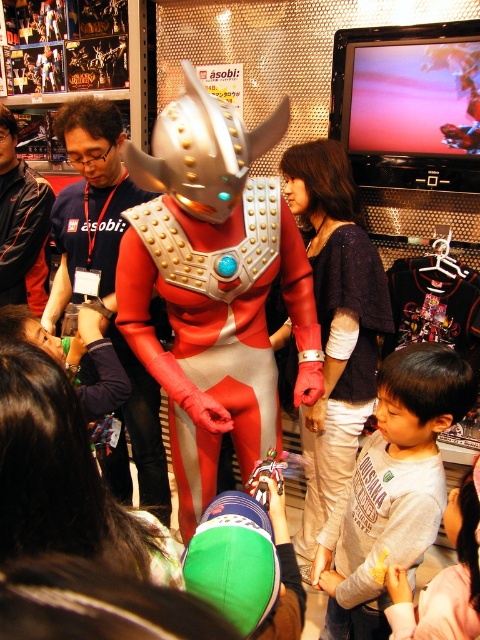
You are a customer in the store and want to buy the matte red costume at center and the dark blue fabric shirt at center. The store has a rule that if one item is placed below another, you can only purchase the lower one. Which item can you buy?

The matte red costume at center is below the dark blue fabric shirt at center, so according to the store rule, you can only purchase the matte red costume at center.

You are standing in the toy store scene. There is a point marked at coordinates (107, 282). Which object is located at that point?

The point at coordinates (107, 282) marks the matte red costume at center.

You are a photographer at the event and need to capture both the matte red costume at center and the dark blue fabric shirt at center in a single frame. Which object should you focus on first to ensure both are in the frame?

The matte red costume at center is larger than the dark blue fabric shirt at center, so you should focus on the matte red costume at center first to ensure both fit within the frame.